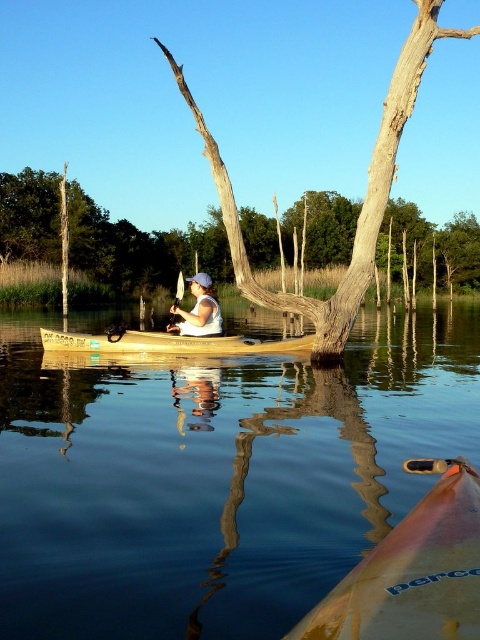
You are planning to kayak through the serene water area shown in the image. The kayak you have is 1.2 meters wide. Based on the scene, will your kayak fit through the space between the clear water at center and the brown rough tree trunk at center?

The clear water at center is wider than the brown rough tree trunk at center. Since the kayak is 1.2 meters wide, it depends on the actual width of the water. However, since the water is wider than the tree trunk, there might be enough space, but without exact measurements, it is uncertain. Please check the width of the clear water at center before proceeding.